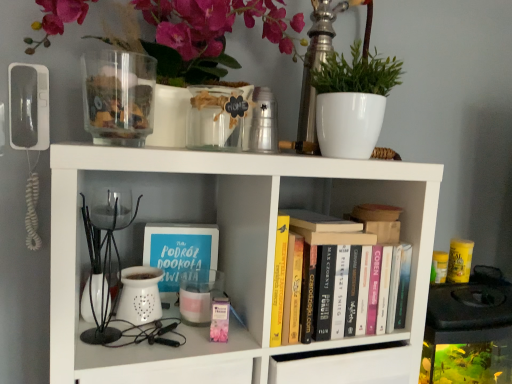
In order to face white ceramic plant at upper right, should I rotate leftwards or rightwards?

Turn right approximately 12.101 degrees to face it.

The image size is (512, 384). What do you see at coordinates (225, 248) in the screenshot?
I see `white matte bookshelf at center` at bounding box center [225, 248].

What are the coordinates of `blue matte book at center-left` in the screenshot? It's located at (179, 250).

The height and width of the screenshot is (384, 512). In order to click on transparent glass jar at upper left, the second glass vase viewed from the right in this screenshot , I will do `click(118, 97)`.

Is transparent glass jar at upper center, placed as the first glass vase when sorted from right to left, to the left of white ceramic plant at upper right from the viewer's perspective?

Yes.

Between transparent glass jar at upper center, placed as the first glass vase when sorted from right to left, and white ceramic plant at upper right, which one has larger size?

white ceramic plant at upper right is bigger.

Is transparent glass jar at upper center, which is counted as the second glass vase, starting from the left, inside or outside of white ceramic plant at upper right?

The correct answer is: outside.

How many degrees apart are the facing directions of transparent glass jar at upper center, which is counted as the second glass vase, starting from the left, and white ceramic plant at upper right?

There is a 0.000883-degree angle between the facing directions of transparent glass jar at upper center, which is counted as the second glass vase, starting from the left, and white ceramic plant at upper right.

Can you confirm if transparent glass jar at upper center, placed as the first glass vase when sorted from right to left, is positioned to the right of blue matte book at center-left?

Correct, you'll find transparent glass jar at upper center, placed as the first glass vase when sorted from right to left, to the right of blue matte book at center-left.

From the image's perspective, which is below, transparent glass jar at upper center, placed as the first glass vase when sorted from right to left, or blue matte book at center-left?

blue matte book at center-left is shown below in the image.

The image size is (512, 384). Find the location of `book cover beneath the transparent glass jar at upper center, placed as the first glass vase when sorted from right to left (from a real-world perspective)`. book cover beneath the transparent glass jar at upper center, placed as the first glass vase when sorted from right to left (from a real-world perspective) is located at coordinates (179, 250).

Is transparent glass jar at upper center, placed as the first glass vase when sorted from right to left, positioned far away from blue matte book at center-left?

transparent glass jar at upper center, placed as the first glass vase when sorted from right to left, is near blue matte book at center-left, not far away.

In the scene shown: Is white ceramic plant at upper right located outside hardcover books at center?

Yes.

At what (x,y) coordinates should I click in order to perform the action: click on houseplant on the left of hardcover books at center. Please return your answer as a coordinate pair (x, y). Looking at the image, I should click on (352, 102).

Can you confirm if white ceramic plant at upper right is positioned to the left of hardcover books at center?

Correct, you'll find white ceramic plant at upper right to the left of hardcover books at center.

How distant is white ceramic plant at upper right from hardcover books at center?

white ceramic plant at upper right and hardcover books at center are 10.38 inches apart from each other.

Is white matte bookshelf at center closer to camera compared to matte white vase at upper center?

Yes, it is in front of matte white vase at upper center.

Is point (57, 342) closer or farther from the camera than point (179, 54)?

Clearly, point (57, 342) is closer to the camera than point (179, 54).

Is white matte bookshelf at center facing towards matte white vase at upper center?

No, white matte bookshelf at center is not oriented towards matte white vase at upper center.

Can we say white matte bookshelf at center lies outside matte white vase at upper center?

Yes.

From a real-world perspective, is matte white vase at upper center physically above transparent glass jar at upper left, the second glass vase viewed from the right?

Yes, from a real-world perspective, matte white vase at upper center is over transparent glass jar at upper left, the second glass vase viewed from the right

In order to click on floral arrangement on the right of the transparent glass jar at upper left, the second glass vase viewed from the right in this screenshot , I will do `click(198, 34)`.

Is matte white vase at upper center in contact with transparent glass jar at upper left, positioned as the first glass vase in left-to-right order?

No, matte white vase at upper center is not making contact with transparent glass jar at upper left, positioned as the first glass vase in left-to-right order.

Consider the image. Is hardcover books at center inside white matte bookshelf at center?

Yes, white matte bookshelf at center contains hardcover books at center.

Could you tell me if white matte bookshelf at center is facing hardcover books at center?

Yes, white matte bookshelf at center is oriented towards hardcover books at center.

Considering the relative sizes of white matte bookshelf at center and hardcover books at center in the image provided, is white matte bookshelf at center taller than hardcover books at center?

Indeed, white matte bookshelf at center has a greater height compared to hardcover books at center.

Is white matte bookshelf at center positioned far away from hardcover books at center?

No, white matte bookshelf at center is in close proximity to hardcover books at center.

Can you confirm if white matte bookshelf at center is bigger than transparent glass jar at upper center, which is counted as the second glass vase, starting from the left?

Correct, white matte bookshelf at center is larger in size than transparent glass jar at upper center, which is counted as the second glass vase, starting from the left.

Between white matte bookshelf at center and transparent glass jar at upper center, which is counted as the second glass vase, starting from the left, which one has more height?

With more height is white matte bookshelf at center.

Between white matte bookshelf at center and transparent glass jar at upper center, which is counted as the second glass vase, starting from the left, which one appears on the right side from the viewer's perspective?

white matte bookshelf at center is more to the right.

Is white matte bookshelf at center inside the boundaries of transparent glass jar at upper center, placed as the first glass vase when sorted from right to left, or outside?

white matte bookshelf at center is located beyond the bounds of transparent glass jar at upper center, placed as the first glass vase when sorted from right to left.

At what (x,y) coordinates should I click in order to perform the action: click on houseplant located on the right of transparent glass jar at upper center, placed as the first glass vase when sorted from right to left. Please return your answer as a coordinate pair (x, y). Looking at the image, I should click on (352, 102).

In the image, there is a transparent glass jar at upper center, which is counted as the second glass vase, starting from the left. Where is `book cover below it (from the image's perspective)`? The image size is (512, 384). book cover below it (from the image's perspective) is located at coordinates (179, 250).

Estimate the real-world distances between objects in this image. Which object is closer to blue matte book at center-left, white matte bookshelf at center or transparent glass jar at upper left, positioned as the first glass vase in left-to-right order?

white matte bookshelf at center.

Looking at the image, which one is located further to blue matte book at center-left, matte white vase at upper center or white ceramic plant at upper right?

matte white vase at upper center is positioned further to the anchor blue matte book at center-left.

Based on their spatial positions, is white matte bookshelf at center or blue matte book at center-left closer to transparent glass jar at upper left, the second glass vase viewed from the right?

Among the two, white matte bookshelf at center is located nearer to transparent glass jar at upper left, the second glass vase viewed from the right.

Considering their positions, is transparent glass jar at upper left, positioned as the first glass vase in left-to-right order, positioned further to hardcover books at center than blue matte book at center-left?

Based on the image, transparent glass jar at upper left, positioned as the first glass vase in left-to-right order, appears to be further to hardcover books at center.

In the scene shown: Estimate the real-world distances between objects in this image. Which object is closer to blue matte book at center-left, transparent glass jar at upper center, which is counted as the second glass vase, starting from the left, or matte white vase at upper center?

Among the two, transparent glass jar at upper center, which is counted as the second glass vase, starting from the left, is located nearer to blue matte book at center-left.

Which object lies nearer to the anchor point transparent glass jar at upper center, placed as the first glass vase when sorted from right to left, transparent glass jar at upper left, the second glass vase viewed from the right, or matte white vase at upper center?

Among the two, transparent glass jar at upper left, the second glass vase viewed from the right, is located nearer to transparent glass jar at upper center, placed as the first glass vase when sorted from right to left.

Considering their positions, is white matte bookshelf at center positioned closer to transparent glass jar at upper left, positioned as the first glass vase in left-to-right order, than white ceramic plant at upper right?

Based on the image, white matte bookshelf at center appears to be nearer to transparent glass jar at upper left, positioned as the first glass vase in left-to-right order.

Which object lies nearer to the anchor point hardcover books at center, white ceramic plant at upper right or transparent glass jar at upper center, which is counted as the second glass vase, starting from the left?

white ceramic plant at upper right.

The height and width of the screenshot is (384, 512). Find the location of `book cover between transparent glass jar at upper center, which is counted as the second glass vase, starting from the left, and white matte bookshelf at center, in the vertical direction`. book cover between transparent glass jar at upper center, which is counted as the second glass vase, starting from the left, and white matte bookshelf at center, in the vertical direction is located at coordinates (179, 250).

You are a GUI agent. You are given a task and a screenshot of the screen. Output one action in this format:
    pyautogui.click(x=<x>, y=<y>)
    Task: Click on the book cover that lies between transparent glass jar at upper left, positioned as the first glass vase in left-to-right order, and white matte bookshelf at center from top to bottom
    
    Given the screenshot: What is the action you would take?
    pyautogui.click(x=179, y=250)

Locate an element on the screen. book between white ceramic plant at upper right and white matte bookshelf at center in the up-down direction is located at coordinates (347, 276).

Image resolution: width=512 pixels, height=384 pixels. What are the coordinates of `glass vase located between blue matte book at center-left and hardcover books at center in the left-right direction` in the screenshot? It's located at (217, 117).